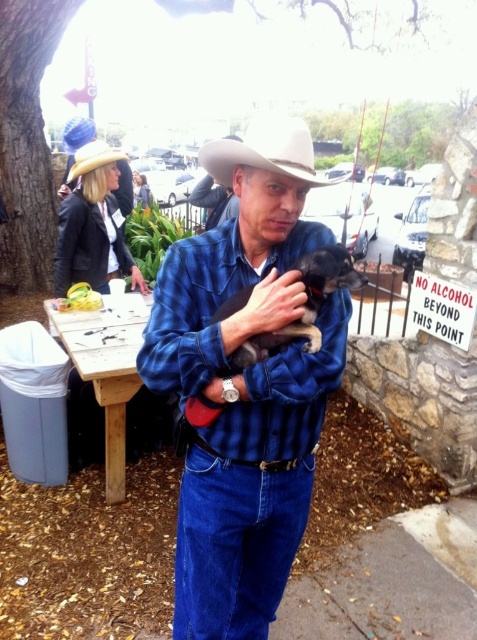
Is wooden picnic table at lower left wider than white matte cowboy hat at center?

Incorrect, wooden picnic table at lower left's width does not surpass white matte cowboy hat at center's.

Can you confirm if wooden picnic table at lower left is positioned to the left of white matte cowboy hat at center?

Indeed, wooden picnic table at lower left is positioned on the left side of white matte cowboy hat at center.

I want to click on wooden picnic table at lower left, so click(106, 368).

Can you confirm if wooden picnic table at lower left is positioned to the left of yellow felt fedora at upper left?

Incorrect, wooden picnic table at lower left is not on the left side of yellow felt fedora at upper left.

Between wooden picnic table at lower left and yellow felt fedora at upper left, which one appears on the left side from the viewer's perspective?

yellow felt fedora at upper left is more to the left.

The image size is (477, 640). What do you see at coordinates (106, 368) in the screenshot? I see `wooden picnic table at lower left` at bounding box center [106, 368].

The height and width of the screenshot is (640, 477). Find the location of `wooden picnic table at lower left`. wooden picnic table at lower left is located at coordinates click(106, 368).

Can you confirm if blue plaid shirt at center is positioned below black fur dog at center?

Indeed, blue plaid shirt at center is positioned under black fur dog at center.

From the picture: Measure the distance from blue plaid shirt at center to black fur dog at center.

The distance of blue plaid shirt at center from black fur dog at center is 9.07 inches.

The height and width of the screenshot is (640, 477). Identify the location of blue plaid shirt at center. (245, 384).